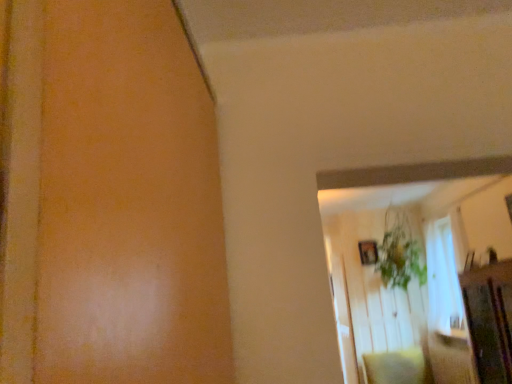
What do you see at coordinates (368, 252) in the screenshot? I see `wooden picture frame at upper right` at bounding box center [368, 252].

You are a GUI agent. You are given a task and a screenshot of the screen. Output one action in this format:
    pyautogui.click(x=<x>, y=<y>)
    Task: Click on the soft beige pillow at lower right
    
    Given the screenshot: What is the action you would take?
    pyautogui.click(x=396, y=367)

This screenshot has width=512, height=384. What are the coordinates of `wooden picture frame at upper right` in the screenshot? It's located at (368, 252).

Can you confirm if wooden picture frame at upper right is wider than green leafy plant at upper center?

Incorrect, the width of wooden picture frame at upper right does not surpass that of green leafy plant at upper center.

From a real-world perspective, who is located higher, wooden picture frame at upper right or green leafy plant at upper center?

From a 3D spatial view, green leafy plant at upper center is above.

Can you tell me how much wooden picture frame at upper right and green leafy plant at upper center differ in facing direction?

0.0987 degrees separate the facing orientations of wooden picture frame at upper right and green leafy plant at upper center.

Consider the image. Is the position of wooden picture frame at upper right more distant than that of green leafy plant at upper center?

Yes, the depth of wooden picture frame at upper right is greater than that of green leafy plant at upper center.

From a real-world perspective, is green leafy plant at upper center physically located above or below soft beige pillow at lower right?

In terms of real-world spatial position, green leafy plant at upper center is above soft beige pillow at lower right.

Which is more to the right, green leafy plant at upper center or soft beige pillow at lower right?

Positioned to the right is green leafy plant at upper center.

From the image's perspective, is green leafy plant at upper center under soft beige pillow at lower right?

No, from the image's perspective, green leafy plant at upper center is not beneath soft beige pillow at lower right.

Which is behind, green leafy plant at upper center or wooden picture frame at upper right?

wooden picture frame at upper right is further from the camera.

Is green leafy plant at upper center positioned with its back to wooden picture frame at upper right?

Yes, green leafy plant at upper center is positioned with its back facing wooden picture frame at upper right.

Is green leafy plant at upper center positioned far away from wooden picture frame at upper right?

They are positioned close to each other.

Is soft beige pillow at lower right turned away from green leafy plant at upper center?

No, green leafy plant at upper center is not at the back of soft beige pillow at lower right.

From a real-world perspective, is soft beige pillow at lower right physically located above or below green leafy plant at upper center?

From a real-world perspective, soft beige pillow at lower right is physically below green leafy plant at upper center.

Can you confirm if soft beige pillow at lower right is wider than green leafy plant at upper center?

Indeed, soft beige pillow at lower right has a greater width compared to green leafy plant at upper center.

Identify the location of pillow below the wooden picture frame at upper right (from the image's perspective). The width and height of the screenshot is (512, 384). (396, 367).

From the image's perspective, which one is positioned higher, wooden picture frame at upper right or soft beige pillow at lower right?

wooden picture frame at upper right, from the image's perspective.

Is wooden picture frame at upper right taller or shorter than soft beige pillow at lower right?

In the image, wooden picture frame at upper right appears to be shorter than soft beige pillow at lower right.

Identify the location of pillow on the right of wooden picture frame at upper right. (396, 367).

Is soft beige pillow at lower right taller than wooden picture frame at upper right?

Yes.

Is soft beige pillow at lower right far away from wooden picture frame at upper right?

soft beige pillow at lower right is positioned a significant distance from wooden picture frame at upper right.

Considering the relative sizes of soft beige pillow at lower right and wooden picture frame at upper right in the image provided, is soft beige pillow at lower right bigger than wooden picture frame at upper right?

Indeed, soft beige pillow at lower right has a larger size compared to wooden picture frame at upper right.

In the image, there is a green leafy plant at upper center. At what (x,y) coordinates should I click in order to perform the action: click on picture frame below it (from the image's perspective). Please return your answer as a coordinate pair (x, y). This screenshot has height=384, width=512. Looking at the image, I should click on (368, 252).

Locate an element on the screen. plant lying above the soft beige pillow at lower right (from the image's perspective) is located at coordinates (400, 254).

Considering their positions, is wooden picture frame at upper right positioned closer to green leafy plant at upper center than soft beige pillow at lower right?

wooden picture frame at upper right lies closer to green leafy plant at upper center than the other object.

Estimate the real-world distances between objects in this image. Which object is further from wooden picture frame at upper right, green leafy plant at upper center or soft beige pillow at lower right?

soft beige pillow at lower right lies further to wooden picture frame at upper right than the other object.

Estimate the real-world distances between objects in this image. Which object is closer to wooden picture frame at upper right, soft beige pillow at lower right or green leafy plant at upper center?

The object closer to wooden picture frame at upper right is green leafy plant at upper center.

Looking at the image, which one is located closer to soft beige pillow at lower right, green leafy plant at upper center or wooden picture frame at upper right?

Based on the image, green leafy plant at upper center appears to be nearer to soft beige pillow at lower right.

Based on their spatial positions, is soft beige pillow at lower right or wooden picture frame at upper right further from green leafy plant at upper center?

The object further to green leafy plant at upper center is soft beige pillow at lower right.

Consider the image. Estimate the real-world distances between objects in this image. Which object is further from soft beige pillow at lower right, wooden picture frame at upper right or green leafy plant at upper center?

The object further to soft beige pillow at lower right is wooden picture frame at upper right.

At what (x,y) coordinates should I click in order to perform the action: click on picture frame between green leafy plant at upper center and soft beige pillow at lower right vertically. Please return your answer as a coordinate pair (x, y). Looking at the image, I should click on (368, 252).